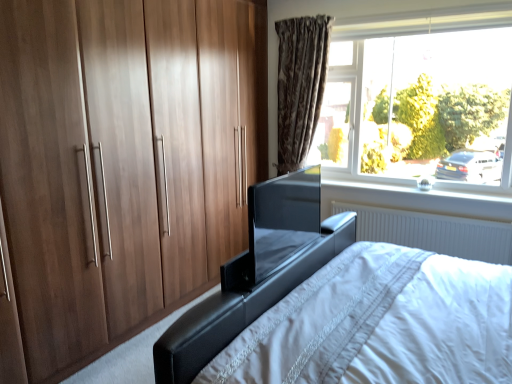
Question: Is transparent glass tv at center outside white glossy window sill at upper right?

Choices:
 (A) no
 (B) yes

Answer: (B)

Question: From a real-world perspective, is transparent glass tv at center positioned over white glossy window sill at upper right based on gravity?

Choices:
 (A) yes
 (B) no

Answer: (A)

Question: Are transparent glass tv at center and white glossy window sill at upper right beside each other?

Choices:
 (A) no
 (B) yes

Answer: (A)

Question: From a real-world perspective, is transparent glass tv at center under white glossy window sill at upper right?

Choices:
 (A) no
 (B) yes

Answer: (A)

Question: Considering the relative sizes of transparent glass tv at center and white glossy window sill at upper right in the image provided, is transparent glass tv at center taller than white glossy window sill at upper right?

Choices:
 (A) no
 (B) yes

Answer: (B)

Question: Considering the relative sizes of transparent glass tv at center and white glossy window sill at upper right in the image provided, is transparent glass tv at center smaller than white glossy window sill at upper right?

Choices:
 (A) yes
 (B) no

Answer: (B)

Question: Is brown textured curtain at upper center turned away from white plastic radiator at lower right?

Choices:
 (A) no
 (B) yes

Answer: (A)

Question: Considering the relative sizes of brown textured curtain at upper center and white plastic radiator at lower right in the image provided, is brown textured curtain at upper center taller than white plastic radiator at lower right?

Choices:
 (A) yes
 (B) no

Answer: (A)

Question: Does brown textured curtain at upper center turn towards white plastic radiator at lower right?

Choices:
 (A) no
 (B) yes

Answer: (A)

Question: From a real-world perspective, is brown textured curtain at upper center on white plastic radiator at lower right?

Choices:
 (A) no
 (B) yes

Answer: (B)

Question: Does brown textured curtain at upper center have a lesser height compared to white plastic radiator at lower right?

Choices:
 (A) no
 (B) yes

Answer: (A)

Question: From the image's perspective, is brown textured curtain at upper center under white plastic radiator at lower right?

Choices:
 (A) yes
 (B) no

Answer: (B)

Question: Is white glossy window sill at upper right oriented away from transparent glass tv at center?

Choices:
 (A) no
 (B) yes

Answer: (A)